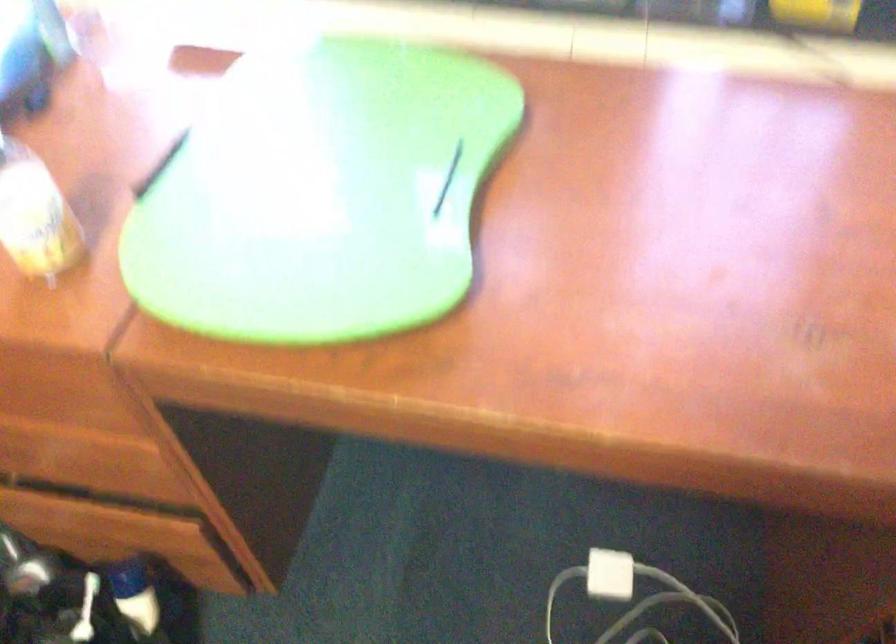
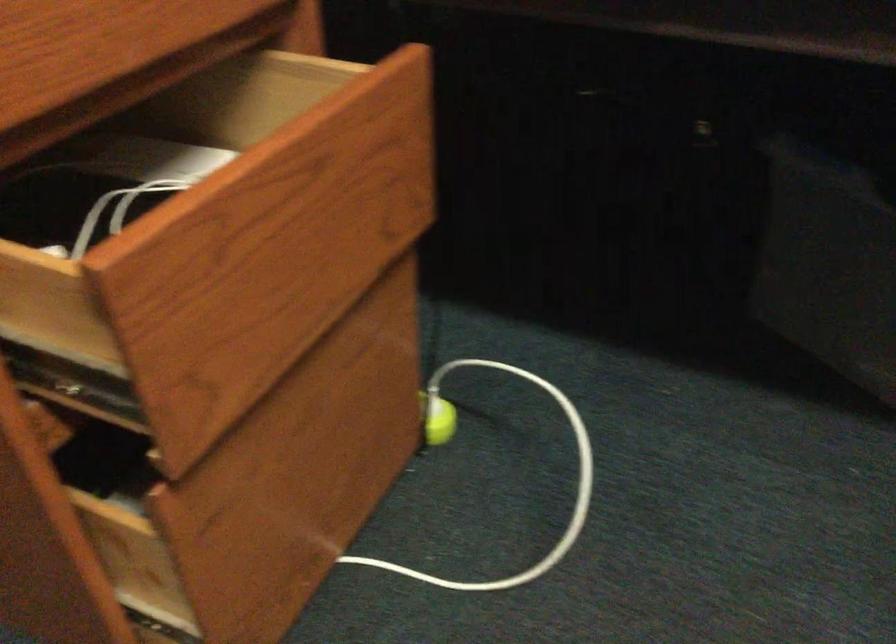
Question: The camera is either moving clockwise (left) or counter-clockwise (right) around the object. The first image is from the beginning of the video and the second image is from the end. Is the camera moving left or right when shooting the video?

Choices:
 (A) Left
 (B) Right

Answer: (A)